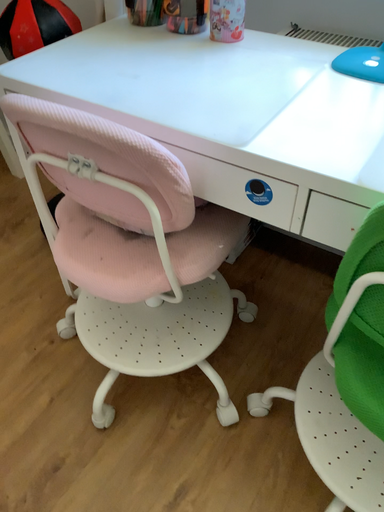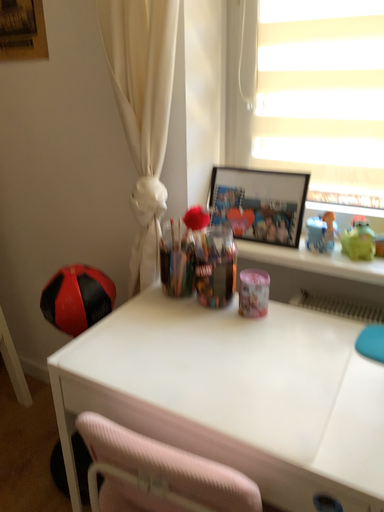
Question: How did the camera likely rotate when shooting the video?

Choices:
 (A) rotated upward
 (B) rotated downward

Answer: (A)